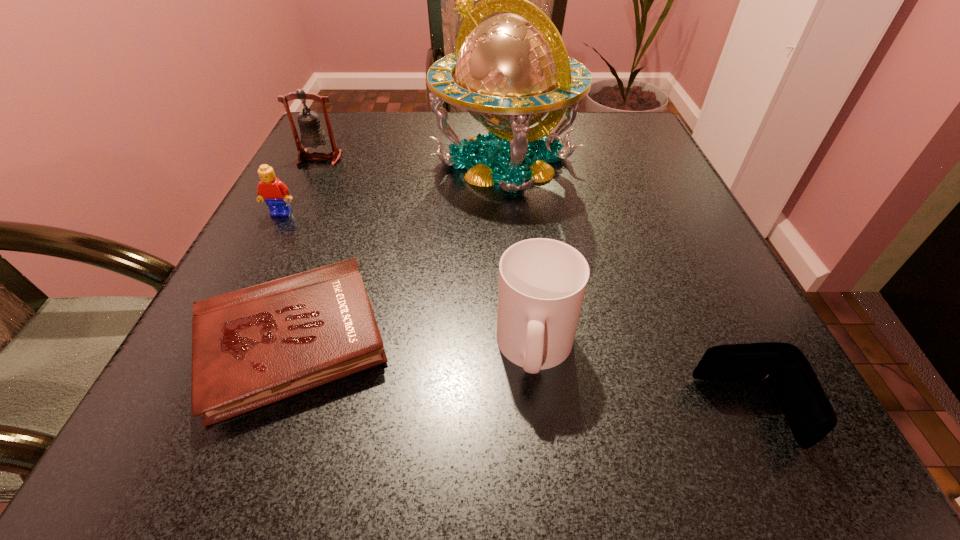
You are a GUI agent. You are given a task and a screenshot of the screen. Output one action in this format:
    pyautogui.click(x=<x>, y=<y>)
    Task: Click on the vacant space that satisfies the following two spatial constraints: 1. on the back side of the tallest object; 2. on the right side of the hardback book
    
    Given the screenshot: What is the action you would take?
    pyautogui.click(x=361, y=161)

You are a GUI agent. You are given a task and a screenshot of the screen. Output one action in this format:
    pyautogui.click(x=<x>, y=<y>)
    Task: Click on the free space that satisfies the following two spatial constraints: 1. on the back side of the globe; 2. on the left side of the hardback book
    The height and width of the screenshot is (540, 960).
    Given the screenshot: What is the action you would take?
    361,161